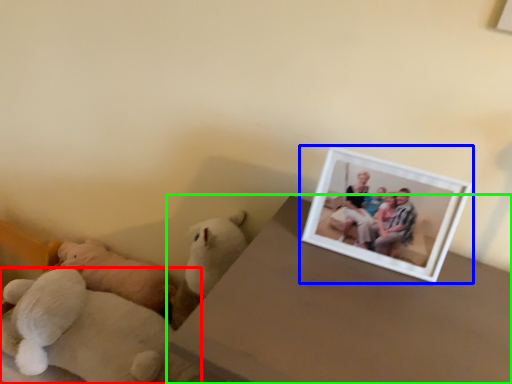
Question: Estimate the real-world distances between objects in this image. Which object is farther from teddy bear (highlighted by a red box), picture frame (highlighted by a blue box) or table (highlighted by a green box)?

Choices:
 (A) picture frame
 (B) table

Answer: (A)